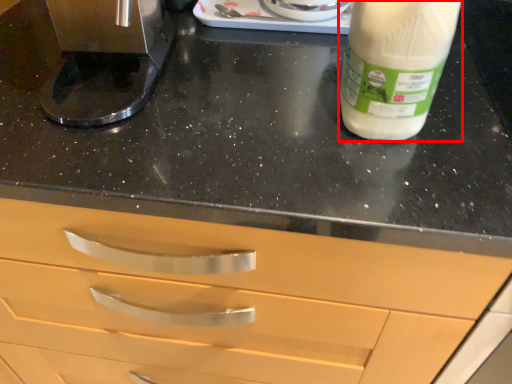
Question: From the image's perspective, what is the correct spatial relationship of yoghurt (annotated by the red box) in relation to coffee machine?

Choices:
 (A) below
 (B) above

Answer: (A)